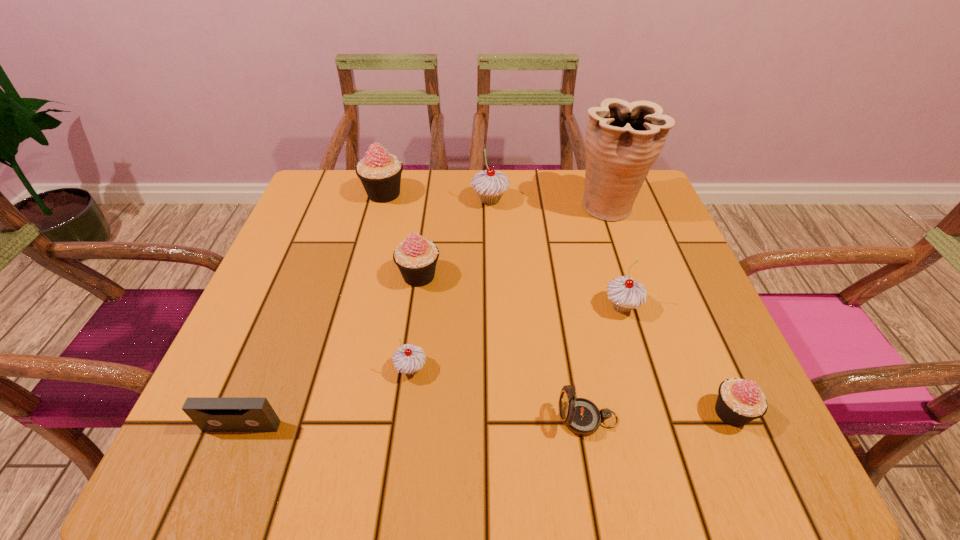
Image resolution: width=960 pixels, height=540 pixels. What are the coordinates of `the tallest object` in the screenshot? It's located at (623, 140).

You are a GUI agent. You are given a task and a screenshot of the screen. Output one action in this format:
    pyautogui.click(x=<x>, y=<y>)
    Task: Click on the fifth object from left to right
    
    Given the screenshot: What is the action you would take?
    pyautogui.click(x=490, y=185)

This screenshot has width=960, height=540. I want to click on the second gray cupcake from left to right, so tap(490, 185).

The image size is (960, 540). What are the coordinates of `the farthest pink cupcake` in the screenshot? It's located at pyautogui.click(x=380, y=173).

Image resolution: width=960 pixels, height=540 pixels. In order to click on the leftmost cupcake in this screenshot , I will do `click(380, 173)`.

Identify the location of the fifth nearest object. The width and height of the screenshot is (960, 540). (625, 293).

Locate an element on the screen. This screenshot has height=540, width=960. the rightmost gray cupcake is located at coordinates (625, 293).

This screenshot has width=960, height=540. Find the location of `the fourth nearest cupcake`. the fourth nearest cupcake is located at coordinates (416, 257).

The image size is (960, 540). I want to click on the sixth nearest object, so (x=416, y=257).

The height and width of the screenshot is (540, 960). I want to click on compass, so click(581, 416).